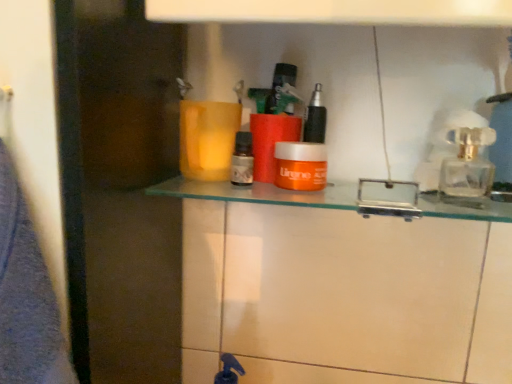
Question: Should I look upward or downward to see transparent glass perfume bottle at upper right?

Choices:
 (A) down
 (B) up

Answer: (B)

Question: Is orange matte jar at center not within transparent glass perfume bottle at upper right?

Choices:
 (A) yes
 (B) no

Answer: (A)

Question: Is orange matte jar at center shorter than transparent glass perfume bottle at upper right?

Choices:
 (A) yes
 (B) no

Answer: (A)

Question: Is orange matte jar at center further to the viewer compared to transparent glass perfume bottle at upper right?

Choices:
 (A) no
 (B) yes

Answer: (A)

Question: From a real-world perspective, is orange matte jar at center physically above transparent glass perfume bottle at upper right?

Choices:
 (A) no
 (B) yes

Answer: (A)

Question: Can you confirm if orange matte jar at center is bigger than transparent glass perfume bottle at upper right?

Choices:
 (A) no
 (B) yes

Answer: (A)

Question: Does orange matte jar at center have a smaller size compared to transparent glass perfume bottle at upper right?

Choices:
 (A) no
 (B) yes

Answer: (B)

Question: Can you confirm if brown glass bottle at center, the second toiletry positioned from the right, is smaller than transparent glass door at left?

Choices:
 (A) no
 (B) yes

Answer: (B)

Question: Is brown glass bottle at center, the second toiletry positioned from the right, taller than transparent glass door at left?

Choices:
 (A) yes
 (B) no

Answer: (B)

Question: Can you confirm if brown glass bottle at center, the second toiletry positioned from the right, is bigger than transparent glass door at left?

Choices:
 (A) yes
 (B) no

Answer: (B)

Question: Is brown glass bottle at center, the 1th toiletry positioned from the left, in front of transparent glass door at left?

Choices:
 (A) no
 (B) yes

Answer: (A)

Question: Is brown glass bottle at center, the second toiletry positioned from the right, at the left side of transparent glass door at left?

Choices:
 (A) no
 (B) yes

Answer: (A)

Question: Can you confirm if brown glass bottle at center, the 1th toiletry positioned from the left, is thinner than transparent glass door at left?

Choices:
 (A) no
 (B) yes

Answer: (B)

Question: Is orange plastic container at center touching orange matte jar at center?

Choices:
 (A) no
 (B) yes

Answer: (B)